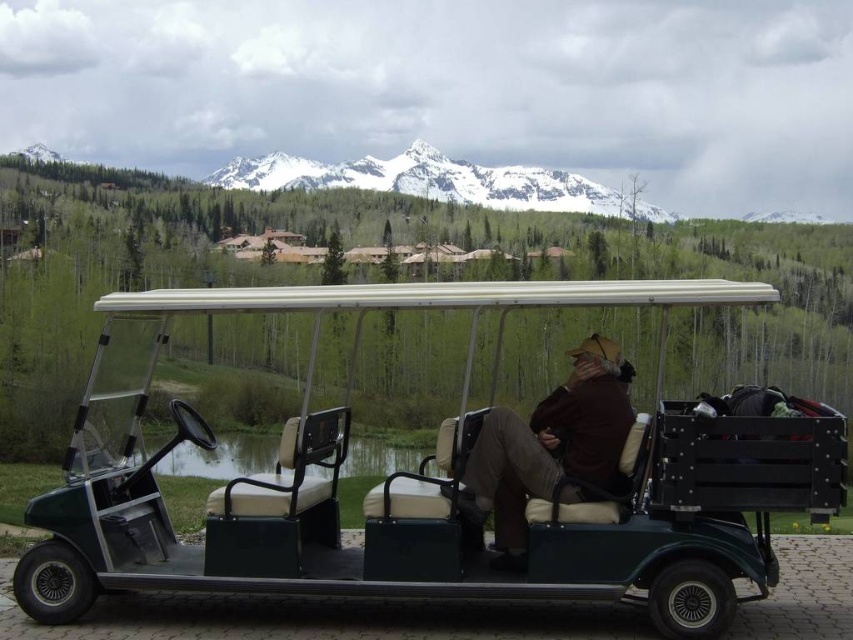
Question: Does brown leather jacket at center have a smaller size compared to snowy peak at upper center?

Choices:
 (A) yes
 (B) no

Answer: (A)

Question: Which point is farther to the camera?

Choices:
 (A) (589, 500)
 (B) (495, 196)

Answer: (B)

Question: Which point is farther from the camera taking this photo?

Choices:
 (A) (537, 189)
 (B) (508, 436)

Answer: (A)

Question: Can you confirm if brown leather jacket at center is positioned to the right of snowy peak at upper center?

Choices:
 (A) yes
 (B) no

Answer: (A)

Question: From the image, what is the correct spatial relationship of green matte golf cart at center in relation to snowy peak at upper center?

Choices:
 (A) below
 (B) above

Answer: (A)

Question: Which object appears farthest from the camera in this image?

Choices:
 (A) green matte golf cart at center
 (B) snowy peak at upper center

Answer: (B)